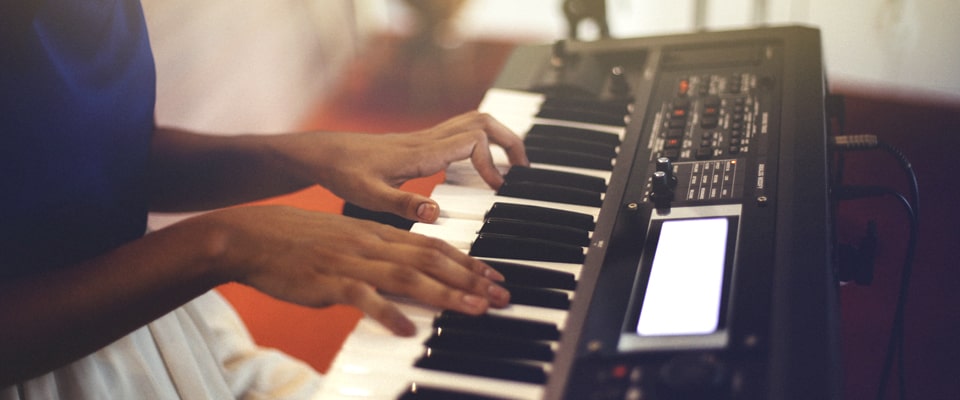
Find the location of a particular element. The image size is (960, 400). keyboard is located at coordinates (773, 190), (798, 286), (588, 73), (620, 283).